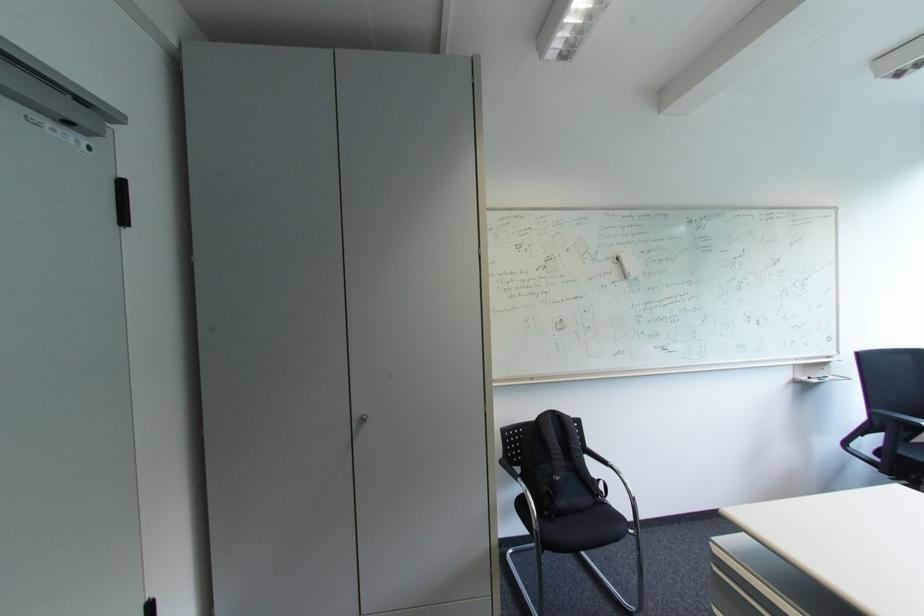
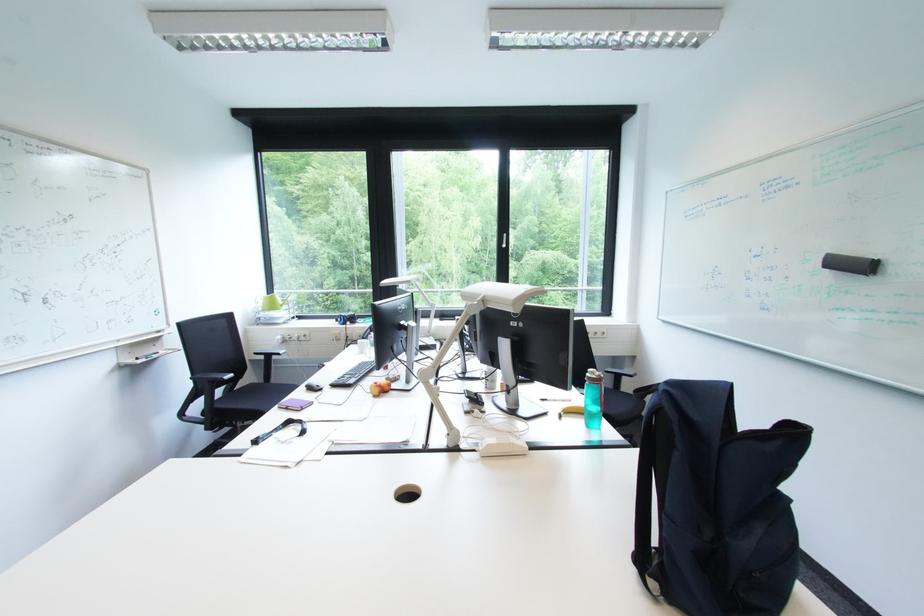
Question: How did the camera likely rotate?

Choices:
 (A) Left
 (B) Right
 (C) Up
 (D) Down

Answer: (B)